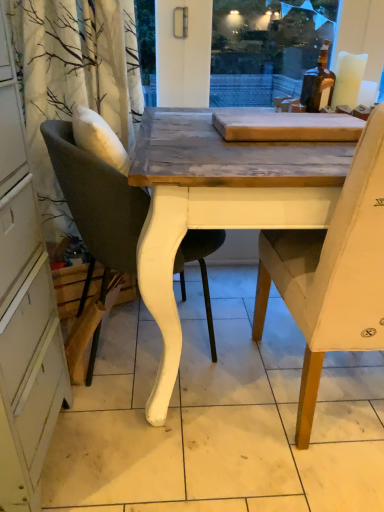
At what (x,y) coordinates should I click in order to perform the action: click on vacant region under matte gray cushioned chair at left, the second chair viewed from the right (from a real-world perspective). Please return your answer as a coordinate pair (x, y). Looking at the image, I should click on (150, 350).